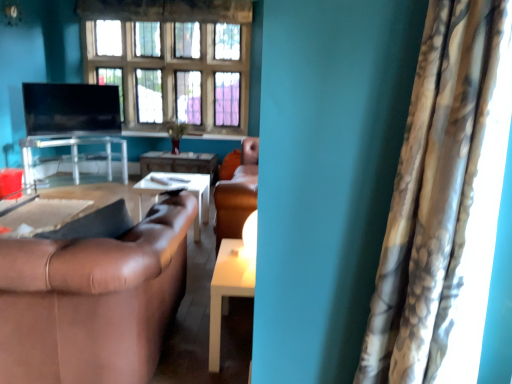
Question: Which direction should I rotate to look at white glossy table at center, placed as the 1th table when sorted from front to back?

Choices:
 (A) left
 (B) right

Answer: (A)

Question: From a real-world perspective, is matte black tv at upper left over clear glass table at center, acting as the second table starting from the front?

Choices:
 (A) no
 (B) yes

Answer: (B)

Question: Is matte black tv at upper left next to clear glass table at center, which is the first table from left to right, and touching it?

Choices:
 (A) yes
 (B) no

Answer: (B)

Question: From the image's perspective, is matte black tv at upper left beneath clear glass table at center, acting as the second table starting from the front?

Choices:
 (A) yes
 (B) no

Answer: (B)

Question: Is matte black tv at upper left not near clear glass table at center, acting as the second table starting from the front?

Choices:
 (A) yes
 (B) no

Answer: (B)

Question: Is matte black tv at upper left outside of clear glass table at center, arranged as the 1th table when viewed from the top?

Choices:
 (A) no
 (B) yes

Answer: (B)

Question: From a real-world perspective, is matte black tv at upper left positioned under clear glass table at center, arranged as the second table when viewed from the back, based on gravity?

Choices:
 (A) no
 (B) yes

Answer: (A)

Question: Does matte black tv at upper left have a lesser height compared to camouflage fabric curtain at right?

Choices:
 (A) no
 (B) yes

Answer: (B)

Question: Can you confirm if matte black tv at upper left is taller than camouflage fabric curtain at right?

Choices:
 (A) no
 (B) yes

Answer: (A)

Question: From the image's perspective, would you say matte black tv at upper left is positioned over camouflage fabric curtain at right?

Choices:
 (A) no
 (B) yes

Answer: (B)

Question: Is matte black tv at upper left to the right of camouflage fabric curtain at right from the viewer's perspective?

Choices:
 (A) no
 (B) yes

Answer: (A)

Question: Is matte black tv at upper left to the left of camouflage fabric curtain at right from the viewer's perspective?

Choices:
 (A) no
 (B) yes

Answer: (B)

Question: From a real-world perspective, is matte black tv at upper left over camouflage fabric curtain at right?

Choices:
 (A) no
 (B) yes

Answer: (A)

Question: Can you confirm if camouflage fabric curtain at right is positioned to the left of wooden glossy table at center, arranged as the third table when viewed from the front?

Choices:
 (A) yes
 (B) no

Answer: (B)